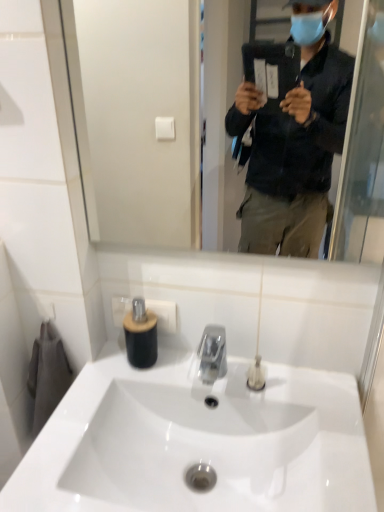
Question: Is clear plastic tube at center, which ranks as the 2th toiletry in left-to-right order, wider than white glossy sink at center?

Choices:
 (A) no
 (B) yes

Answer: (A)

Question: Can you confirm if clear plastic tube at center, which ranks as the 2th toiletry in left-to-right order, is bigger than white glossy sink at center?

Choices:
 (A) yes
 (B) no

Answer: (B)

Question: Does clear plastic tube at center, the 1th toiletry viewed from the right, appear on the right side of white glossy sink at center?

Choices:
 (A) no
 (B) yes

Answer: (B)

Question: Considering the relative sizes of clear plastic tube at center, the 1th toiletry viewed from the right, and white glossy sink at center in the image provided, is clear plastic tube at center, the 1th toiletry viewed from the right, shorter than white glossy sink at center?

Choices:
 (A) no
 (B) yes

Answer: (B)

Question: Is clear plastic tube at center, which ranks as the 2th toiletry in left-to-right order, not inside white glossy sink at center?

Choices:
 (A) no
 (B) yes

Answer: (B)

Question: From the image's perspective, is black matte soap dispenser at center, which is counted as the second toiletry, starting from the right, positioned above or below white glossy sink at center?

Choices:
 (A) above
 (B) below

Answer: (A)

Question: Is black matte soap dispenser at center, which is counted as the 1th toiletry, starting from the left, wider or thinner than white glossy sink at center?

Choices:
 (A) wide
 (B) thin

Answer: (B)

Question: Choose the correct answer: Is black matte soap dispenser at center, which is counted as the second toiletry, starting from the right, inside white glossy sink at center or outside it?

Choices:
 (A) inside
 (B) outside

Answer: (B)

Question: In terms of height, does black matte soap dispenser at center, which is counted as the 1th toiletry, starting from the left, look taller or shorter compared to white glossy sink at center?

Choices:
 (A) tall
 (B) short

Answer: (A)

Question: Is clear plastic tube at center, the 1th toiletry viewed from the right, bigger or smaller than clear glass mirror at upper center?

Choices:
 (A) big
 (B) small

Answer: (B)

Question: Is clear plastic tube at center, which ranks as the 2th toiletry in left-to-right order, spatially inside clear glass mirror at upper center, or outside of it?

Choices:
 (A) inside
 (B) outside

Answer: (B)

Question: From a real-world perspective, is clear plastic tube at center, which ranks as the 2th toiletry in left-to-right order, positioned above or below clear glass mirror at upper center?

Choices:
 (A) above
 (B) below

Answer: (B)

Question: In terms of height, does clear plastic tube at center, which ranks as the 2th toiletry in left-to-right order, look taller or shorter compared to clear glass mirror at upper center?

Choices:
 (A) short
 (B) tall

Answer: (A)

Question: Does point (190, 444) appear closer or farther from the camera than point (160, 202)?

Choices:
 (A) farther
 (B) closer

Answer: (B)

Question: Considering their positions, is white glossy sink at center located in front of or behind clear glass mirror at upper center?

Choices:
 (A) behind
 (B) front

Answer: (B)